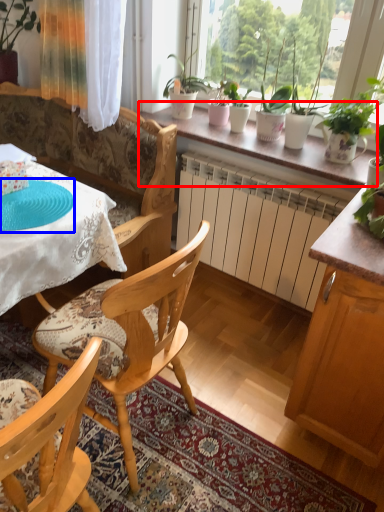
Question: Which point is closer to the camera, window sill (highlighted by a red box) or paper plate (highlighted by a blue box)?

Choices:
 (A) window sill
 (B) paper plate

Answer: (B)